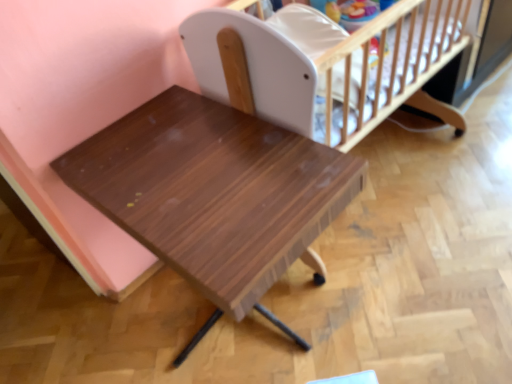
This screenshot has height=384, width=512. Find the location of `blank space above wooden table at center (from a real-world perspective)`. blank space above wooden table at center (from a real-world perspective) is located at coordinates (177, 185).